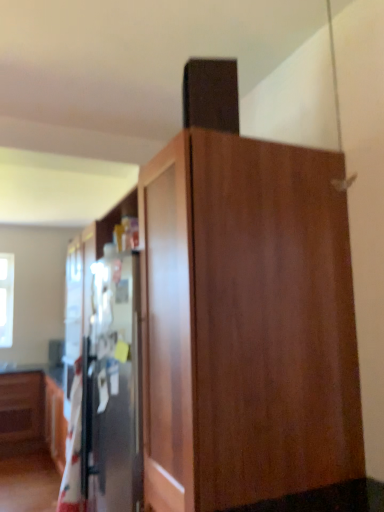
What do you see at coordinates (73, 450) in the screenshot? I see `white cotton blanket at left` at bounding box center [73, 450].

Describe the element at coordinates (248, 323) in the screenshot. The height and width of the screenshot is (512, 384). I see `wooden cabinet at center` at that location.

The height and width of the screenshot is (512, 384). Find the location of `white cotton blanket at left`. white cotton blanket at left is located at coordinates (73, 450).

From the picture: From the image's perspective, does white cotton blanket at left appear higher than wooden cabinet at center?

No, from the image's perspective, white cotton blanket at left is not above wooden cabinet at center.

Looking at their sizes, would you say white cotton blanket at left is wider or thinner than wooden cabinet at center?

Considering their sizes, white cotton blanket at left looks slimmer than wooden cabinet at center.

Which is farther, (78, 418) or (343, 357)?

Positioned behind is point (78, 418).

Based on their sizes in the image, would you say white cotton blanket at left is bigger or smaller than wooden cabinet at center?

In the image, white cotton blanket at left appears to be smaller than wooden cabinet at center.

Which object is thinner, white cotton blanket at left or transparent glass window at upper left?

With smaller width is transparent glass window at upper left.

Does white cotton blanket at left lie in front of transparent glass window at upper left?

Yes, white cotton blanket at left is closer to the camera.

From the image's perspective, is white cotton blanket at left above transparent glass window at upper left?

No, from the image's perspective, white cotton blanket at left is not above transparent glass window at upper left.

Find the location of `window above the white cotton blanket at left (from a real-world perspective)`. window above the white cotton blanket at left (from a real-world perspective) is located at coordinates (6, 298).

Which is in front, transparent glass window at upper left or wooden cabinet at center?

wooden cabinet at center is closer to the camera.

Is transparent glass window at upper left with wooden cabinet at center?

No, transparent glass window at upper left is not making contact with wooden cabinet at center.

Considering the relative positions of transparent glass window at upper left and wooden cabinet at center in the image provided, is transparent glass window at upper left to the left of wooden cabinet at center from the viewer's perspective?

Correct, you'll find transparent glass window at upper left to the left of wooden cabinet at center.

In the scene shown: Could you tell me if transparent glass window at upper left is facing wooden cabinet at center?

No, transparent glass window at upper left does not turn towards wooden cabinet at center.

Does wooden cabinet at center appear on the right side of white cotton blanket at left?

Indeed, wooden cabinet at center is positioned on the right side of white cotton blanket at left.

From a real-world perspective, is wooden cabinet at center beneath white cotton blanket at left?

No, from a real-world perspective, wooden cabinet at center is not below white cotton blanket at left.

Considering the relative sizes of wooden cabinet at center and white cotton blanket at left in the image provided, is wooden cabinet at center shorter than white cotton blanket at left?

No, wooden cabinet at center is not shorter than white cotton blanket at left.

Is the surface of wooden cabinet at center in direct contact with white cotton blanket at left?

No, wooden cabinet at center is not beside white cotton blanket at left.

Is wooden cabinet at center positioned far away from transparent glass window at upper left?

Yes, wooden cabinet at center and transparent glass window at upper left are located far from each other.

Which object is positioned more to the left, wooden cabinet at center or transparent glass window at upper left?

transparent glass window at upper left is more to the left.

Which is closer, (333,234) or (13,266)?

Clearly, point (333,234) is closer to the camera than point (13,266).

Can you confirm if wooden cabinet at center is smaller than transparent glass window at upper left?

Actually, wooden cabinet at center might be larger than transparent glass window at upper left.

How distant is transparent glass window at upper left from white cotton blanket at left?

transparent glass window at upper left and white cotton blanket at left are 3.20 meters apart.

Identify the location of window to the left of white cotton blanket at left. (6, 298).

Considering the relative sizes of transparent glass window at upper left and white cotton blanket at left in the image provided, is transparent glass window at upper left smaller than white cotton blanket at left?

Indeed, transparent glass window at upper left has a smaller size compared to white cotton blanket at left.

In terms of height, does transparent glass window at upper left look taller or shorter compared to white cotton blanket at left?

transparent glass window at upper left is shorter than white cotton blanket at left.

Find the location of a particular element. The image size is (384, 512). cupboard above the white cotton blanket at left (from a real-world perspective) is located at coordinates (248, 323).

Where is `blanket below the transparent glass window at upper left (from the image's perspective)`? blanket below the transparent glass window at upper left (from the image's perspective) is located at coordinates (73, 450).

From the image, which object appears to be farther from transparent glass window at upper left, wooden cabinet at center or white cotton blanket at left?

The object further to transparent glass window at upper left is wooden cabinet at center.

Which object lies further to the anchor point white cotton blanket at left, transparent glass window at upper left or wooden cabinet at center?

Based on the image, transparent glass window at upper left appears to be further to white cotton blanket at left.

Based on the photo, based on their spatial positions, is wooden cabinet at center or transparent glass window at upper left closer to white cotton blanket at left?

wooden cabinet at center.

When comparing their distances from transparent glass window at upper left, does white cotton blanket at left or wooden cabinet at center seem further?

wooden cabinet at center.

Estimate the real-world distances between objects in this image. Which object is further from wooden cabinet at center, transparent glass window at upper left or white cotton blanket at left?

The object further to wooden cabinet at center is transparent glass window at upper left.

Looking at the image, which one is located further to wooden cabinet at center, white cotton blanket at left or transparent glass window at upper left?

Based on the image, transparent glass window at upper left appears to be further to wooden cabinet at center.

I want to click on blanket between wooden cabinet at center and transparent glass window at upper left from front to back, so click(x=73, y=450).